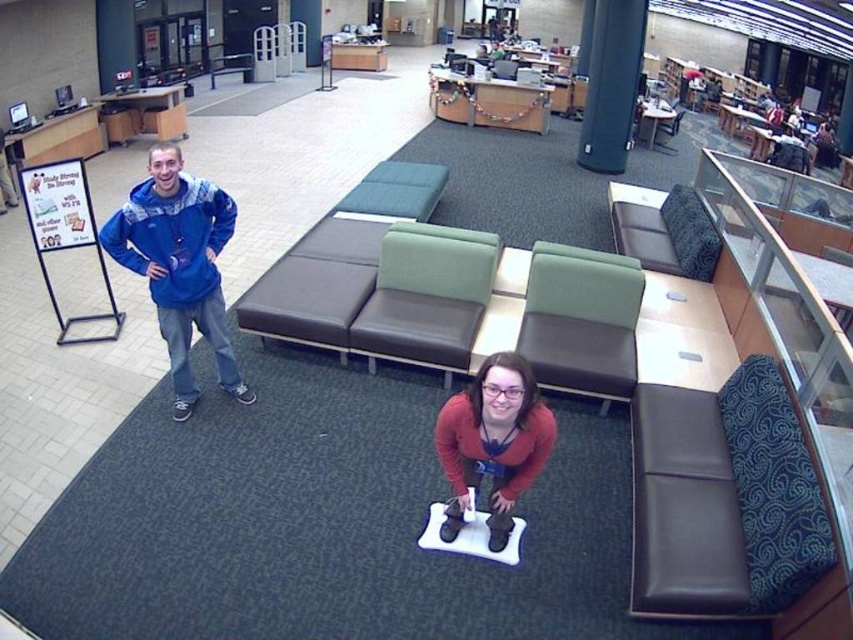
You are a visitor in the library and want to sit down. There is a green fabric couch at center and a matte red sweater at center. Which one can you sit on?

The green fabric couch at center is larger and designed for sitting, so you can sit on the green fabric couch at center.

You are standing in the library and want to sit on the dark brown leather couch at upper right. Which direction should you move relative to the blue fleece jacket at left?

To reach the dark brown leather couch at upper right, you should move upwards from the blue fleece jacket at left since the blue fleece jacket at left is located below it.

You are trying to decide which clothing item to take for a casual day out. Both the blue fleece jacket at left and the matte red sweater at center are options. Based on their sizes shown in the image, which one would you choose if you prefer a larger size?

The blue fleece jacket at left is bigger than the matte red sweater at center, so you should choose the blue fleece jacket at left if you prefer a larger size.